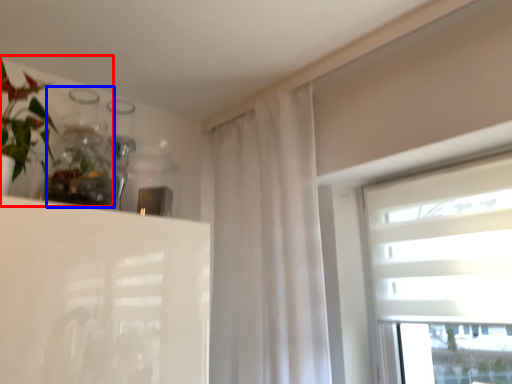
Question: Which of the following is the farthest to the observer, floral arrangement (highlighted by a red box) or glass vase (highlighted by a blue box)?

Choices:
 (A) floral arrangement
 (B) glass vase

Answer: (B)